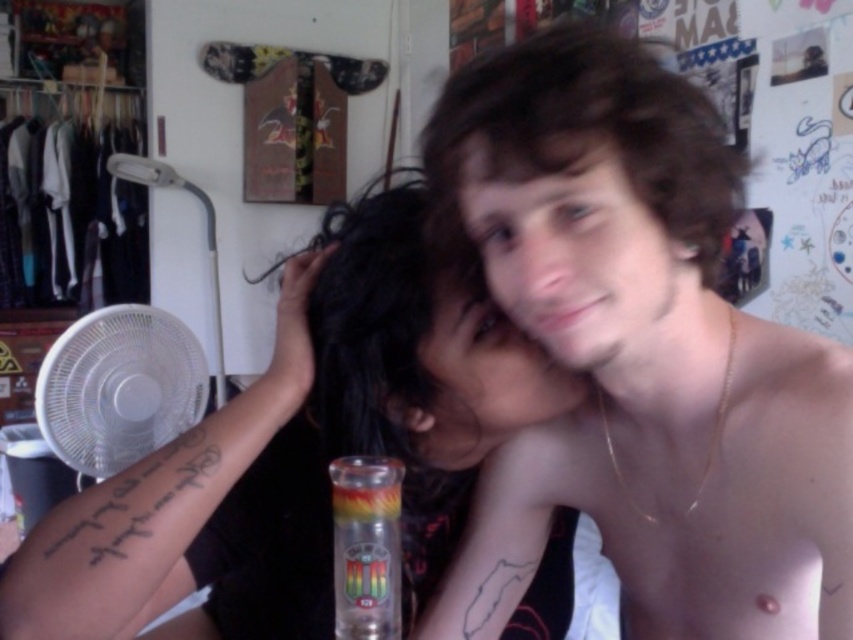
Question: Is white plastic fan at left to the right of translucent glass can at center from the viewer's perspective?

Choices:
 (A) no
 (B) yes

Answer: (A)

Question: Which point is farther to the camera?

Choices:
 (A) (405, 524)
 (B) (715, 179)
 (C) (148, 474)

Answer: (A)

Question: Based on their relative distances, which object is farther from the white plastic fan at left?

Choices:
 (A) dark curly hair at center
 (B) translucent glass can at center
 (C) black hair at center
 (D) black tattooed arm at center

Answer: (A)

Question: Observing the image, what is the correct spatial positioning of shiny gold necklace at upper right in reference to translucent glass can at center?

Choices:
 (A) below
 (B) above

Answer: (B)

Question: Which of the following is the farthest from the observer?

Choices:
 (A) (276, 388)
 (B) (444, 570)
 (C) (352, 525)
 (D) (670, 81)

Answer: (B)

Question: Is shiny gold necklace at upper right positioned at the back of black tattooed arm at left?

Choices:
 (A) yes
 (B) no

Answer: (B)